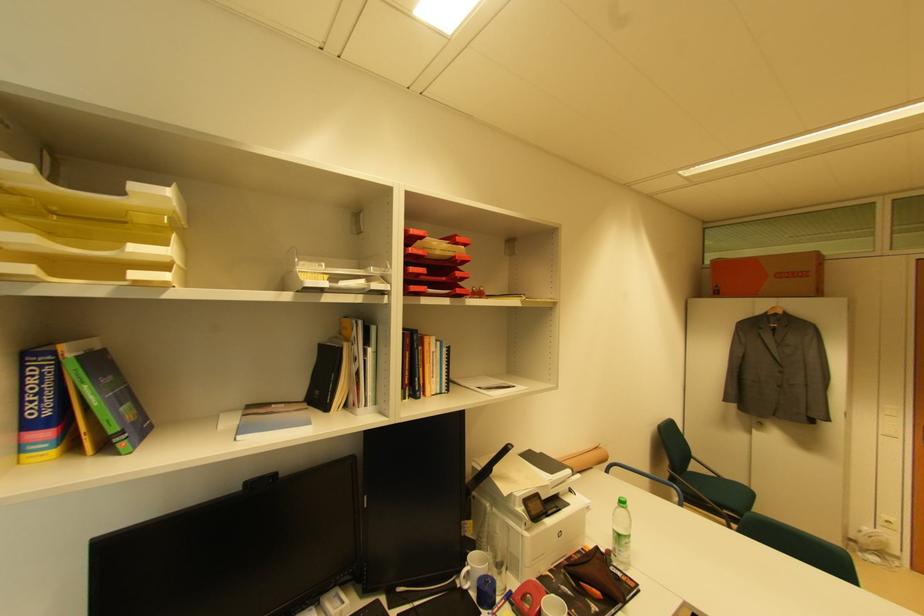
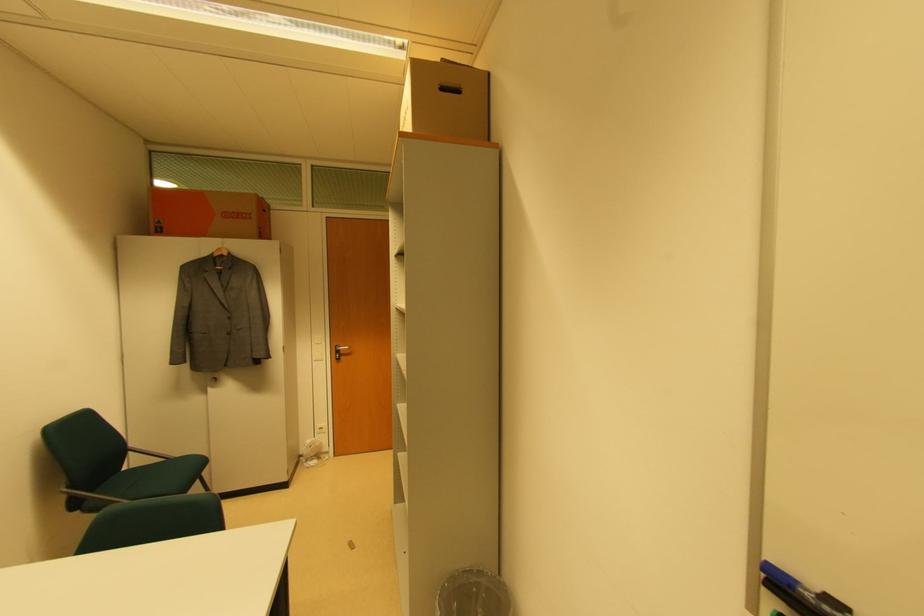
In the second image, find the point that corresponds to [673,472] in the first image.

(69, 488)